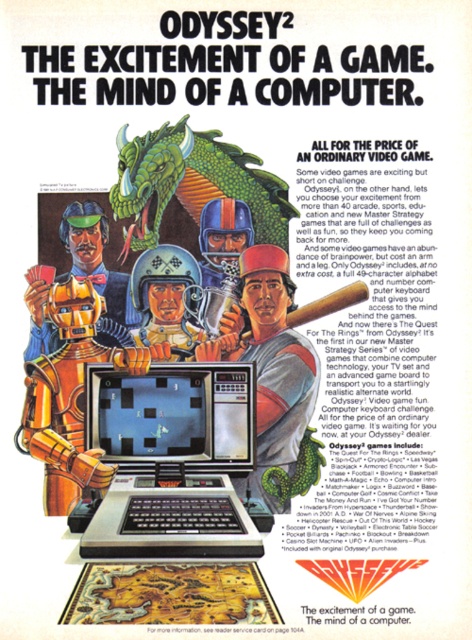
Where is `silver metallic laptop at center`? This screenshot has height=640, width=472. silver metallic laptop at center is located at coordinates (173, 458).

Does silver metallic laptop at center have a lesser width compared to green matte dragon at upper center?

Indeed, silver metallic laptop at center has a lesser width compared to green matte dragon at upper center.

Identify the location of silver metallic laptop at center. This screenshot has width=472, height=640. (173, 458).

Locate an element on the screen. silver metallic laptop at center is located at coordinates (173, 458).